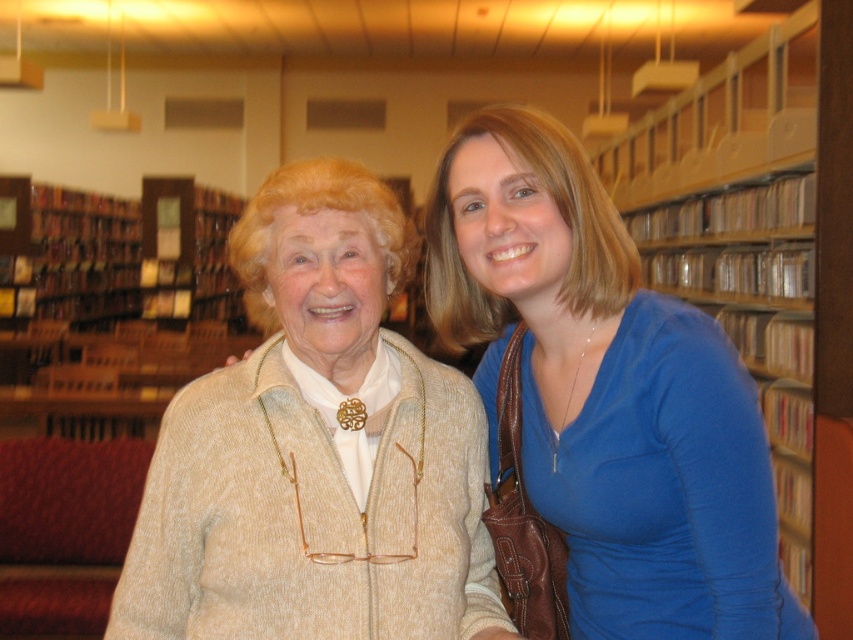
You are a photographer trying to capture a clear photo of the blue smooth shirt at center. However, the beige textured sweater at center is blocking your view. Can you adjust your position to take the photo without moving the subjects?

The blue smooth shirt at center is behind the beige textured sweater at center, so you can move to the side to get a clear shot around the beige textured sweater at center.

You are a photographer trying to capture the perfect shot of the beige textured sweater at center. The camera you are using has a focus point at coordinate 0.705, 0.372. Will the sweater be in focus?

Yes, the beige textured sweater at center is exactly at the focus point (316, 451), so it will be in focus.